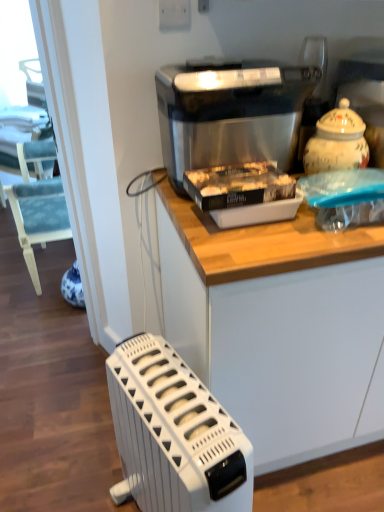
Question: From the image's perspective, is white plastic radiator at lower left under stainless steel ice maker at center?

Choices:
 (A) no
 (B) yes

Answer: (B)

Question: From the image's perspective, does white plastic radiator at lower left appear higher than stainless steel ice maker at center?

Choices:
 (A) no
 (B) yes

Answer: (A)

Question: Could you tell me if white plastic radiator at lower left is turned towards stainless steel ice maker at center?

Choices:
 (A) no
 (B) yes

Answer: (A)

Question: Is white plastic radiator at lower left smaller than stainless steel ice maker at center?

Choices:
 (A) yes
 (B) no

Answer: (B)

Question: Is white plastic radiator at lower left positioned far away from stainless steel ice maker at center?

Choices:
 (A) no
 (B) yes

Answer: (A)

Question: Considering the relative positions of stainless steel ice maker at center and white plastic radiator at lower left in the image provided, is stainless steel ice maker at center to the left or to the right of white plastic radiator at lower left?

Choices:
 (A) right
 (B) left

Answer: (A)

Question: Is point (195, 153) closer or farther from the camera than point (139, 367)?

Choices:
 (A) farther
 (B) closer

Answer: (A)

Question: In terms of width, does stainless steel ice maker at center look wider or thinner when compared to white plastic radiator at lower left?

Choices:
 (A) wide
 (B) thin

Answer: (B)

Question: From their relative heights in the image, would you say stainless steel ice maker at center is taller or shorter than white plastic radiator at lower left?

Choices:
 (A) short
 (B) tall

Answer: (A)

Question: In the image, is white plastic radiator at lower left positioned in front of or behind white matte cabinet at upper center?

Choices:
 (A) front
 (B) behind

Answer: (A)

Question: From the image's perspective, is white plastic radiator at lower left positioned above or below white matte cabinet at upper center?

Choices:
 (A) below
 (B) above

Answer: (A)

Question: From a real-world perspective, is white plastic radiator at lower left above or below white matte cabinet at upper center?

Choices:
 (A) above
 (B) below

Answer: (B)

Question: Looking at their shapes, would you say white plastic radiator at lower left is wider or thinner than white matte cabinet at upper center?

Choices:
 (A) thin
 (B) wide

Answer: (A)

Question: From the image's perspective, is white matte cabinet at upper center located above or below stainless steel ice maker at center?

Choices:
 (A) below
 (B) above

Answer: (A)

Question: From their relative heights in the image, would you say white matte cabinet at upper center is taller or shorter than stainless steel ice maker at center?

Choices:
 (A) tall
 (B) short

Answer: (A)